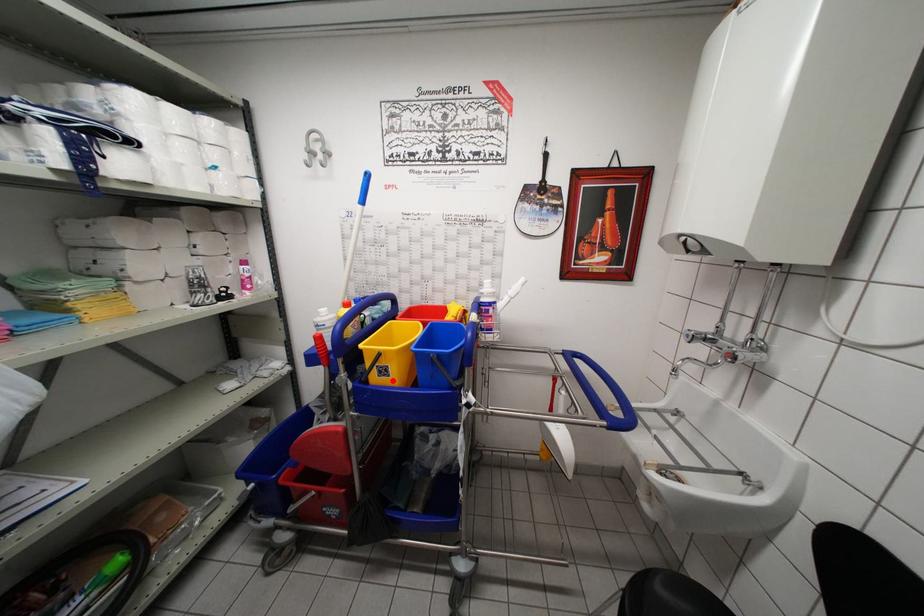
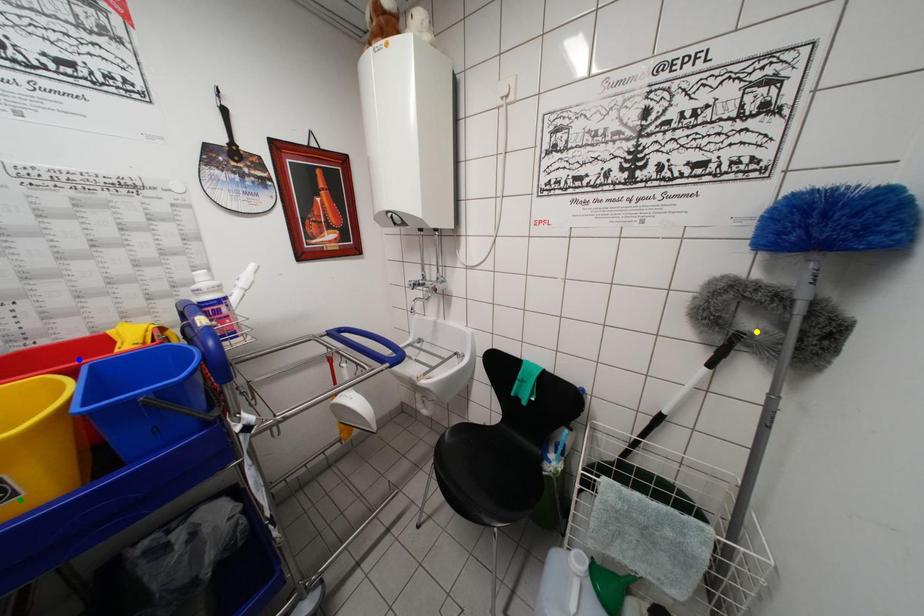
Question: I am providing you with two images of the same scene from different viewpoints. A red point is marked on the first image. You are given multiple points on the second image. In image 2, which mark is for the same physical point as the one in image 1?

Choices:
 (A) blue point
 (B) yellow point
 (C) green point

Answer: (C)